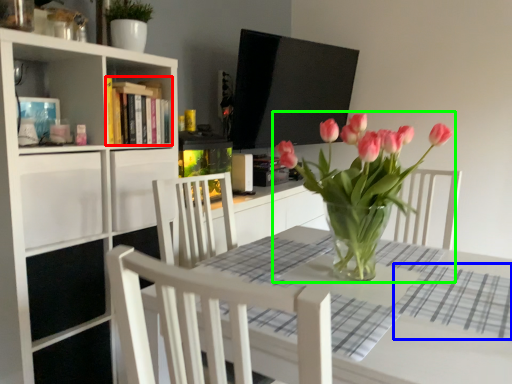
Question: Estimate the real-world distances between objects in this image. Which object is closer to book (highlighted by a red box), plaid (highlighted by a blue box) or houseplant (highlighted by a green box)?

Choices:
 (A) plaid
 (B) houseplant

Answer: (B)